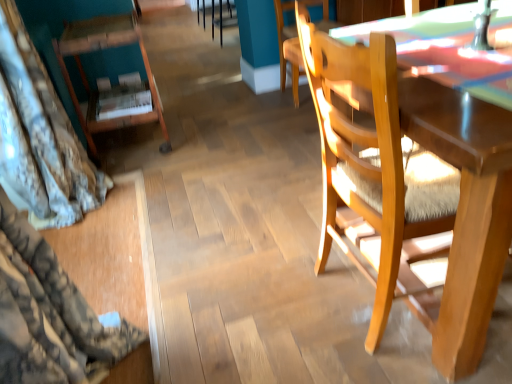
Question: Are wooden bookshelf at left, placed as the 1th chair when sorted from left to right, and wooden chair at center, which ranks as the 2th chair in right-to-left order, far apart?

Choices:
 (A) yes
 (B) no

Answer: (A)

Question: Does wooden bookshelf at left, arranged as the 2th chair when viewed from the front, have a lesser height compared to wooden chair at center, which ranks as the 2th chair in right-to-left order?

Choices:
 (A) no
 (B) yes

Answer: (A)

Question: From a real-world perspective, is wooden bookshelf at left, placed as the 1th chair when sorted from left to right, physically above wooden chair at center, which ranks as the 2th chair in right-to-left order?

Choices:
 (A) no
 (B) yes

Answer: (B)

Question: Considering the relative positions of wooden bookshelf at left, which is counted as the 3th chair, starting from the right, and wooden chair at center, which is the 1th chair in back-to-front order, in the image provided, is wooden bookshelf at left, which is counted as the 3th chair, starting from the right, to the left of wooden chair at center, which is the 1th chair in back-to-front order, from the viewer's perspective?

Choices:
 (A) yes
 (B) no

Answer: (A)

Question: Is wooden bookshelf at left, arranged as the 2th chair when viewed from the front, further to the viewer compared to wooden chair at center, the third chair from the front?

Choices:
 (A) yes
 (B) no

Answer: (B)

Question: Choose the correct answer: Is wooden chair at center, which is the 1th chair in back-to-front order, inside wooden bookshelf at left, placed as the 1th chair when sorted from left to right, or outside it?

Choices:
 (A) inside
 (B) outside

Answer: (B)

Question: Considering their positions, is wooden chair at center, which ranks as the 2th chair in right-to-left order, located in front of or behind wooden bookshelf at left, arranged as the 2th chair when viewed from the front?

Choices:
 (A) behind
 (B) front

Answer: (A)

Question: From a real-world perspective, is wooden chair at center, which is the 1th chair in back-to-front order, above or below wooden bookshelf at left, which is counted as the 3th chair, starting from the right?

Choices:
 (A) below
 (B) above

Answer: (A)

Question: Is wooden chair at center, the 2th chair positioned from the left, bigger or smaller than wooden bookshelf at left, arranged as the 2th chair when viewed from the front?

Choices:
 (A) small
 (B) big

Answer: (A)

Question: Is wooden chair at right, the 3th chair positioned from the left, wider or thinner than wooden chair at center, which ranks as the 2th chair in right-to-left order?

Choices:
 (A) thin
 (B) wide

Answer: (B)

Question: Is wooden chair at right, arranged as the first chair when viewed from the front, taller or shorter than wooden chair at center, the third chair from the front?

Choices:
 (A) tall
 (B) short

Answer: (A)

Question: Is wooden chair at right, the 3th chair positioned from the left, bigger or smaller than wooden chair at center, the third chair from the front?

Choices:
 (A) small
 (B) big

Answer: (B)

Question: From a real-world perspective, is wooden chair at right, arranged as the first chair when viewed from the front, physically located above or below wooden chair at center, the third chair from the front?

Choices:
 (A) below
 (B) above

Answer: (B)

Question: Is wooden chair at right, the 1th chair in the right-to-left sequence, wider or thinner than wooden bookshelf at left, arranged as the 2th chair when viewed from the front?

Choices:
 (A) wide
 (B) thin

Answer: (A)

Question: From their relative heights in the image, would you say wooden chair at right, the 3th chair positioned from the left, is taller or shorter than wooden bookshelf at left, placed as the 1th chair when sorted from left to right?

Choices:
 (A) short
 (B) tall

Answer: (B)